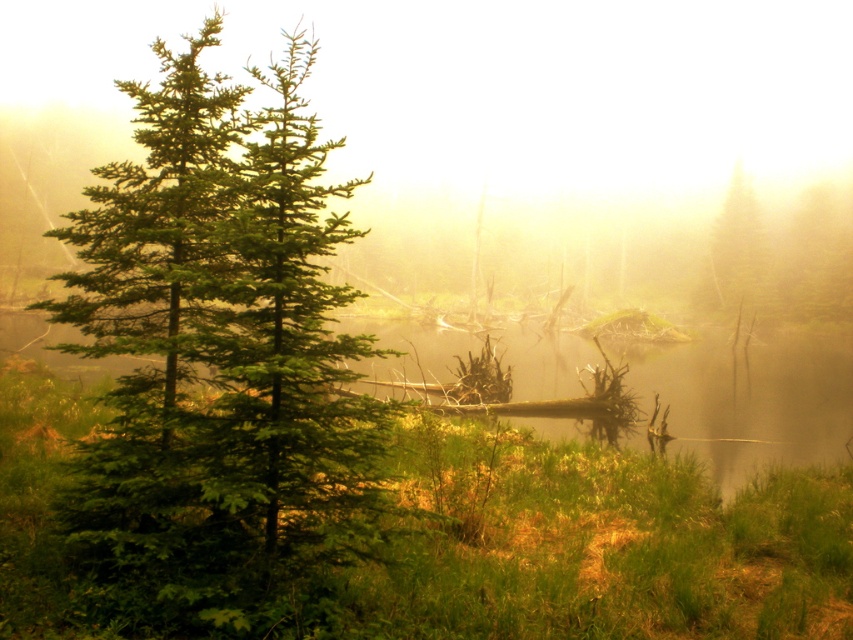
Who is more distant from viewer, (283,493) or (759,240)?

The point (759,240) is more distant.

Does green matte tree at left have a larger size compared to green matte tree at upper right?

Indeed, green matte tree at left has a larger size compared to green matte tree at upper right.

You are a GUI agent. You are given a task and a screenshot of the screen. Output one action in this format:
    pyautogui.click(x=<x>, y=<y>)
    Task: Click on the green matte tree at left
    Image resolution: width=853 pixels, height=640 pixels.
    Given the screenshot: What is the action you would take?
    pyautogui.click(x=221, y=364)